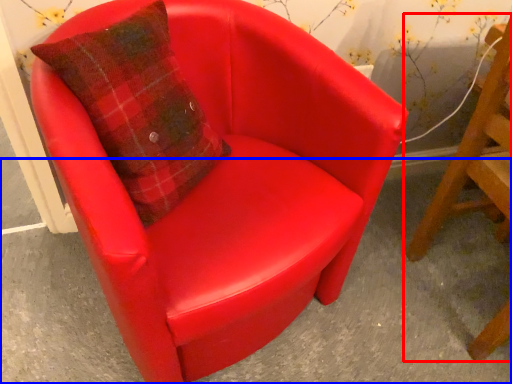
Question: Which of the following is the farthest to the observer, chair (highlighted by a red box) or concrete (highlighted by a blue box)?

Choices:
 (A) chair
 (B) concrete

Answer: (B)